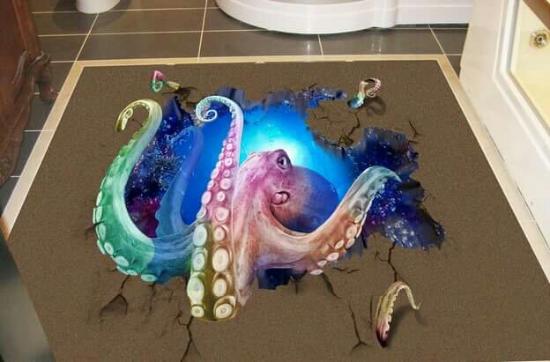
I want to click on brown tile floor, so click(x=157, y=40).